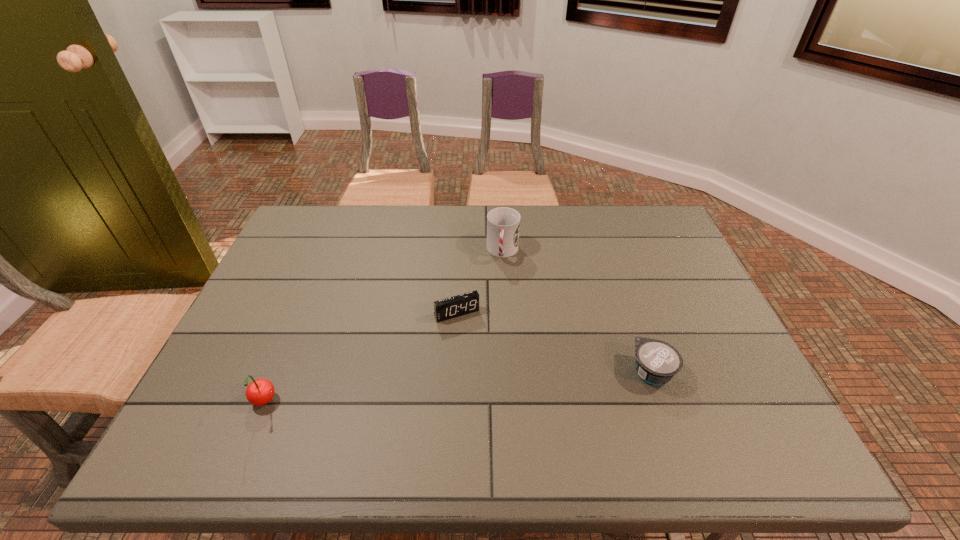
Locate an element on the screen. the leftmost object is located at coordinates (259, 392).

Where is `the rightmost object`? Image resolution: width=960 pixels, height=540 pixels. the rightmost object is located at coordinates (657, 362).

In order to click on the farthest object in this screenshot , I will do `click(503, 224)`.

Identify the location of cup. tap(503, 224).

Identify the location of the second object from left to right. This screenshot has width=960, height=540. click(x=466, y=303).

The image size is (960, 540). What are the coordinates of `the second farthest object` in the screenshot? It's located at (466, 303).

Identify the location of vacant space located 0.370m on the right of the cherry. This screenshot has height=540, width=960. (445, 403).

Find the location of a particular element. The height and width of the screenshot is (540, 960). free spot located 0.250m on the left of the rightmost object is located at coordinates (522, 372).

The image size is (960, 540). Find the location of `free space located 0.160m on the handle side of the farthest object`. free space located 0.160m on the handle side of the farthest object is located at coordinates (497, 305).

Where is `free space located 0.260m on the handle side of the farthest object`? The height and width of the screenshot is (540, 960). free space located 0.260m on the handle side of the farthest object is located at coordinates (494, 333).